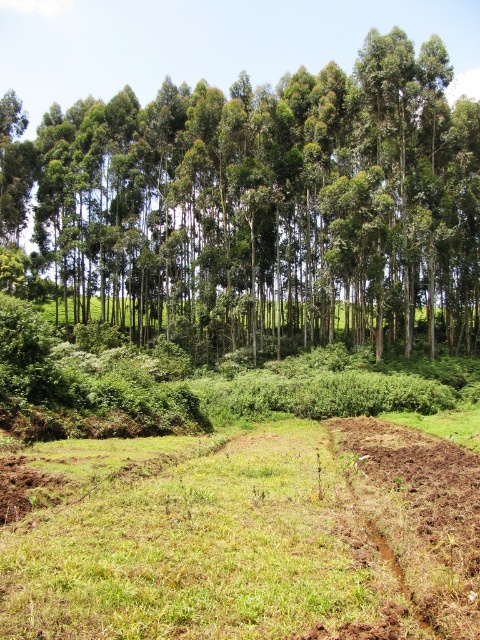
Question: Does green leafy trees at upper center appear on the right side of brown soil at lower right?

Choices:
 (A) yes
 (B) no

Answer: (B)

Question: Can you confirm if green leafy trees at upper center is thinner than brown soil at lower right?

Choices:
 (A) no
 (B) yes

Answer: (A)

Question: Which point appears closest to the camera in this image?

Choices:
 (A) (448, 461)
 (B) (120, 214)

Answer: (A)

Question: Which of the following is the farthest from the observer?

Choices:
 (A) brown soil at lower right
 (B) green leafy trees at upper center

Answer: (B)

Question: Does green leafy trees at upper center appear under brown soil at lower right?

Choices:
 (A) no
 (B) yes

Answer: (A)